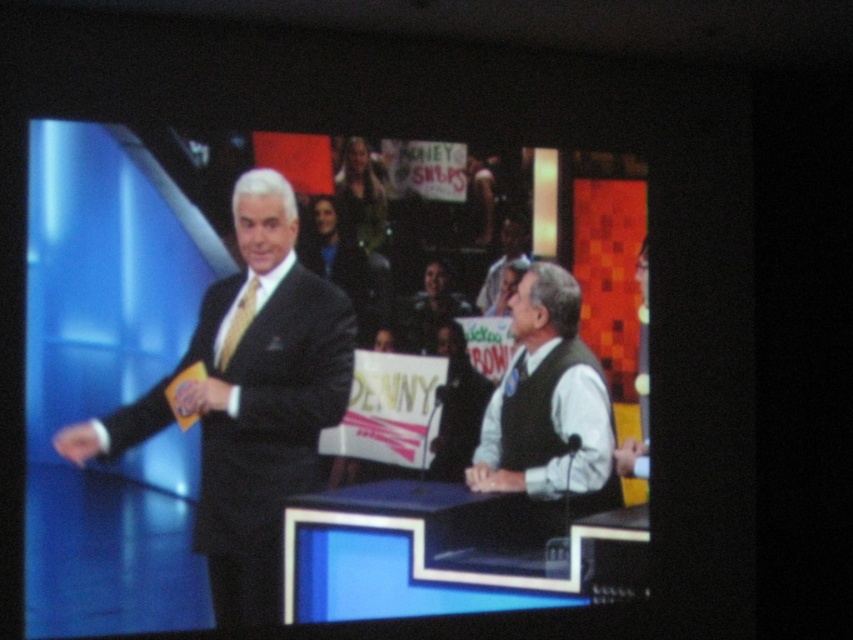
You are a contestant on a game show and you see the shiny black suit at left and the white matte vest at center. Which one is closer to the left side of the stage?

The shiny black suit at left is closer to the left side of the stage because it is positioned to the left of the white matte vest at center.

Based on the scene description, which object is larger in size between the shiny black suit at left and the white matte vest at center?

The shiny black suit at left is bigger than the white matte vest at center according to the description.